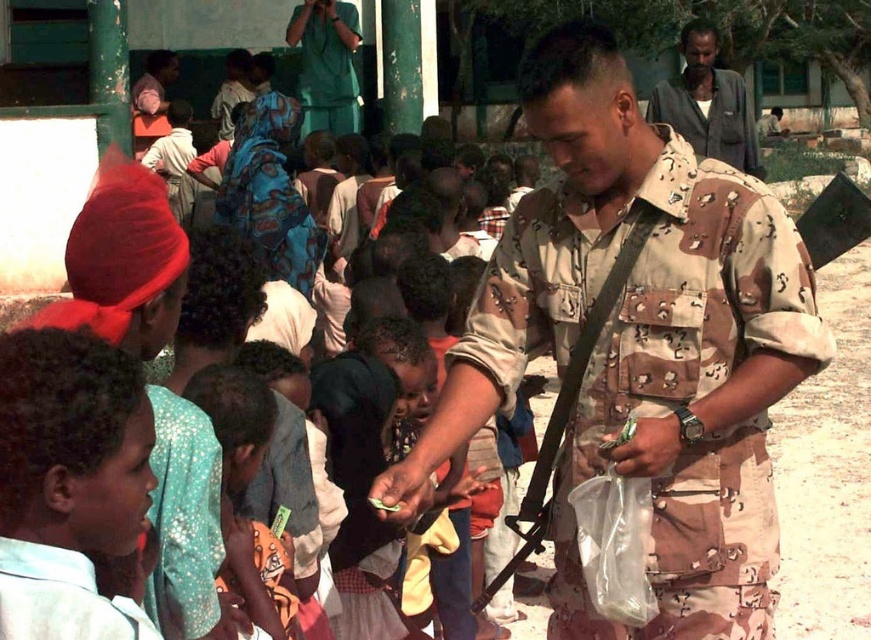
You are a photographer trying to capture a group photo of the light blue shirt at lower left and the green uniform at upper center. Which subject should you focus on first if you want to ensure both are in focus without adjusting the camera settings?

The light blue shirt at lower left is shorter than the green uniform at upper center. Therefore, focus on the green uniform at upper center first to ensure both are in focus.

You are a photographer trying to capture a closeup of the light blue shirt at lower left and the light blue fabric shirt at lower left. Which one should you zoom in on to ensure it fills the frame better?

The light blue shirt at lower left has a larger size compared to the light blue fabric shirt at lower left, so you should zoom in on the light blue shirt at lower left to ensure it fills the frame better.

You are a photographer trying to capture a closeup of the light blue shirt at lower left and the light blue fabric shirt at lower left. Since you want to focus on both, which one should you adjust your camera lens to focus on first based on their height?

The light blue shirt at lower left is taller than the light blue fabric shirt at lower left, so you should focus on the light blue shirt at lower left first as it is taller.